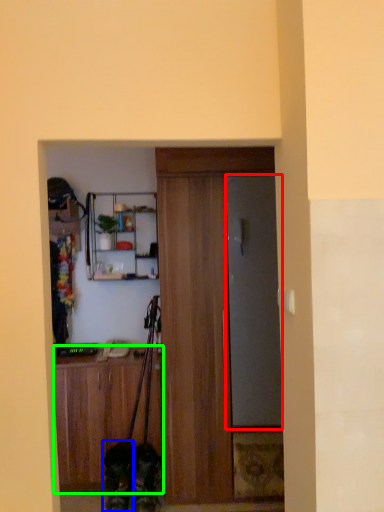
Question: Based on their relative distances, which object is farther from door (highlighted by a red box)? Choose from dog (highlighted by a blue box) and cabinetry (highlighted by a green box).

Choices:
 (A) dog
 (B) cabinetry

Answer: (A)